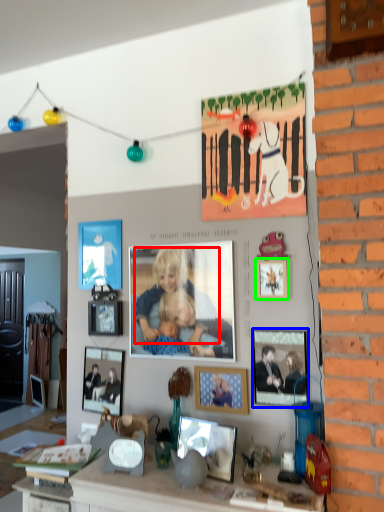
Question: Which object is the farthest from person (highlighted by a red box)? Choose among these: picture frame (highlighted by a blue box) or picture frame (highlighted by a green box).

Choices:
 (A) picture frame
 (B) picture frame

Answer: (A)